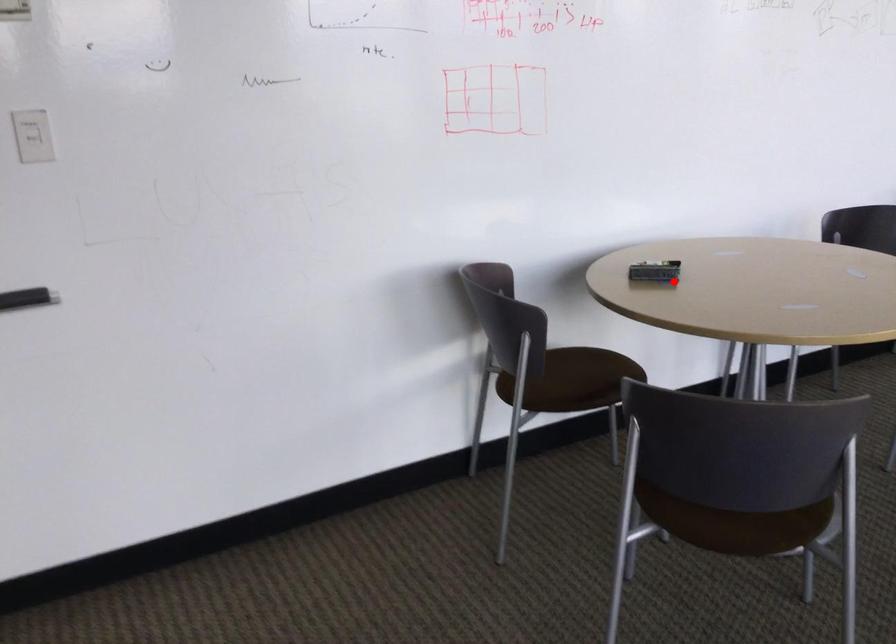
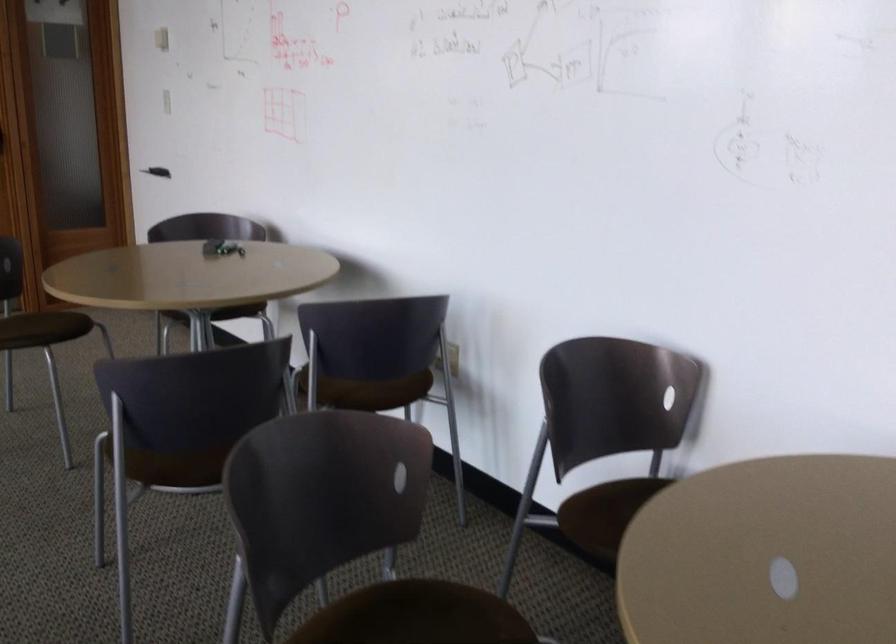
Question: I am providing you with two images of the same scene from different viewpoints. In image1, a red point is highlighted. Considering the same 3D point in image2, which of the following is correct?

Choices:
 (A) It is closer
 (B) It is farther

Answer: (B)